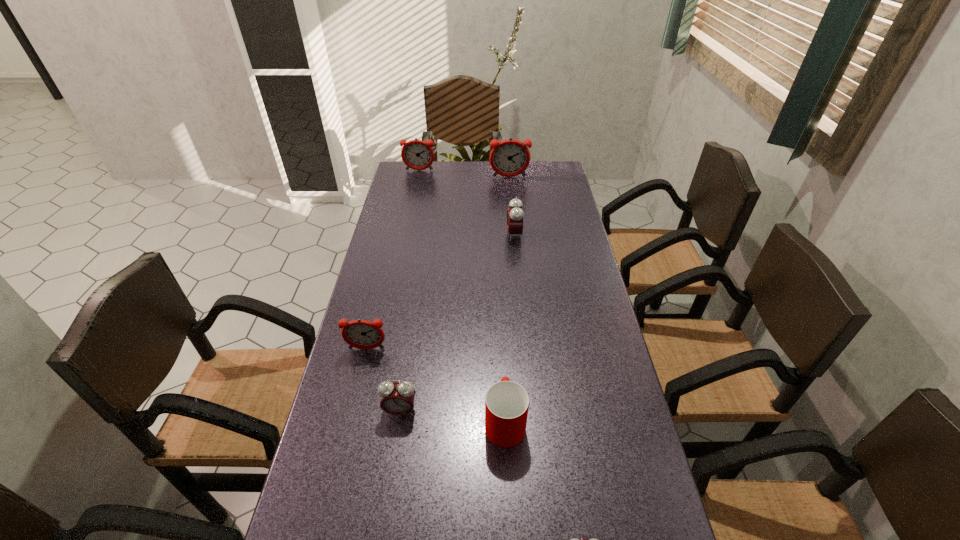
Select which reddish-pink alarm clock is the second closest to the cup. Please provide its 2D coordinates. Your answer should be formatted as a tuple, i.e. [(x, y)], where the tuple contains the x and y coordinates of a point satisfying the conditions above.

[(508, 158)]

Locate an element on the screen. This screenshot has width=960, height=540. the closest pink alarm clock to the biggest pink alarm clock is located at coordinates (397, 398).

Identify which pink alarm clock is located as the nearest to the nearest alarm clock. Please provide its 2D coordinates. Your answer should be formatted as a tuple, i.e. [(x, y)], where the tuple contains the x and y coordinates of a point satisfying the conditions above.

[(397, 398)]

At what (x,y) coordinates should I click in order to perform the action: click on blank area in the image that satisfies the following two spatial constraints: 1. on the front-facing side of the rightmost reddish-pink alarm clock; 2. on the clock face of the biggest pink alarm clock. Please return your answer as a coordinate pair (x, y). This screenshot has width=960, height=540. Looking at the image, I should click on (515, 235).

Locate an element on the screen. This screenshot has width=960, height=540. blank space that satisfies the following two spatial constraints: 1. on the clock face of the third farthest alarm clock; 2. on the front-facing side of the smallest reddish-pink alarm clock is located at coordinates (525, 349).